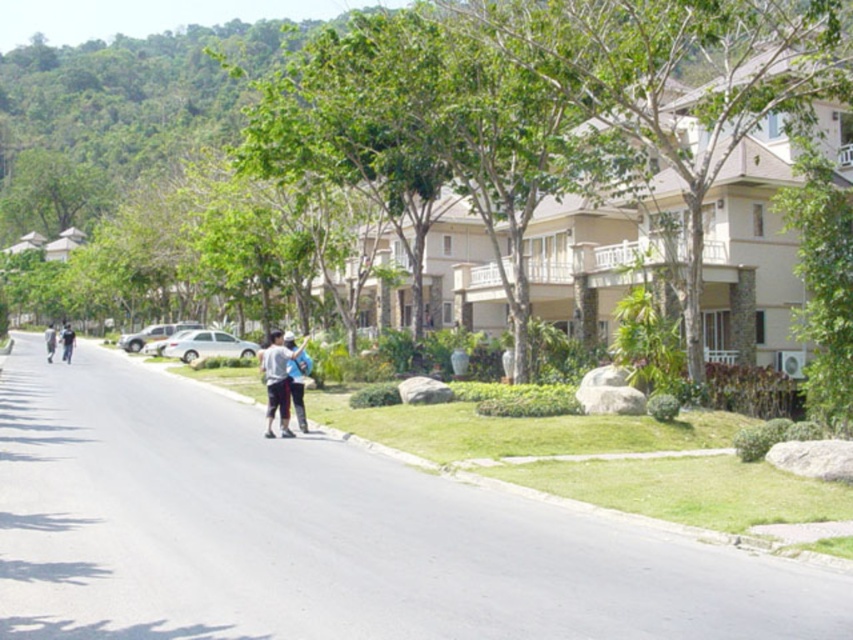
You are standing at the edge of the suburban street and want to reach a specific point marked at coordinates point (279, 346). If your walking speed is 1.5 meters per second, how many seconds will it take you to reach that point?

The distance of point (279, 346) from viewer is 17.32 meters. At a speed of 1.5 meters per second, it will take approximately 11.55 seconds to reach the point.